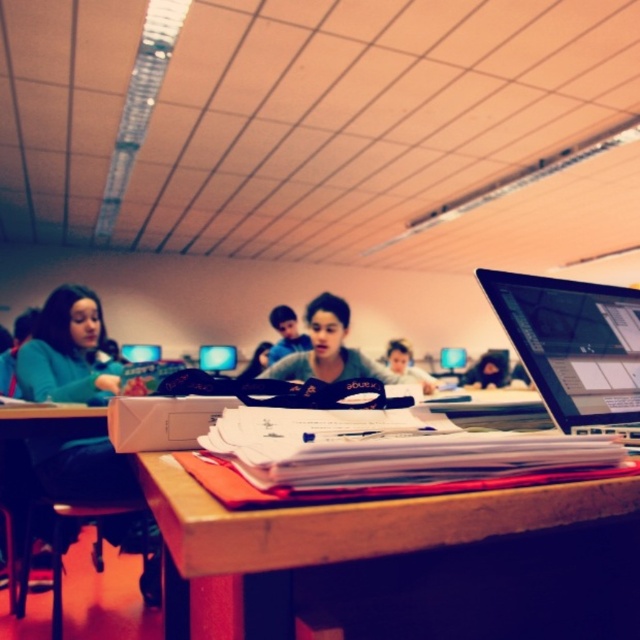
You are a student trying to reach the matte black monitor at center from the desk where the sleek silver laptop at center is placed. Can you easily access it without moving the laptop?

The sleek silver laptop at center is in front of the matte black monitor at center, so you would need to move the laptop to access the monitor.